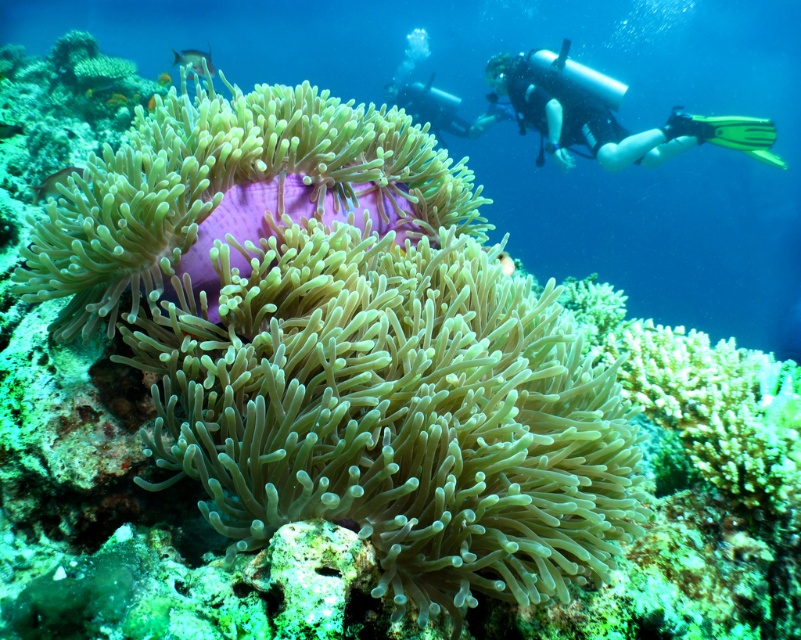
Question: Which of the following is the closest to the observer?

Choices:
 (A) shiny blue fish at upper left
 (B) shiny blue fish at center
 (C) orange matte fish at center
 (D) shiny silver fish at lower left

Answer: (C)

Question: In this image, where is black matte scuba diver at upper right located relative to orange matte fish at upper left?

Choices:
 (A) left
 (B) right

Answer: (B)

Question: Is green soft coral at center above shiny blue fish at upper left?

Choices:
 (A) no
 (B) yes

Answer: (A)

Question: Does translucent green coral at center appear under orange matte fish at upper left?

Choices:
 (A) no
 (B) yes

Answer: (B)

Question: Considering the real-world distances, which object is farthest from the shiny silver fish at upper left?

Choices:
 (A) black matte scuba diver at upper right
 (B) shiny silver fish at lower left
 (C) shiny blue fish at upper left
 (D) green soft coral at center

Answer: (D)

Question: Which is farther from the green soft coral at center?

Choices:
 (A) translucent green coral at center
 (B) black matte scuba diver at upper right
 (C) shiny silver fish at lower left
 (D) orange matte fish at center

Answer: (B)